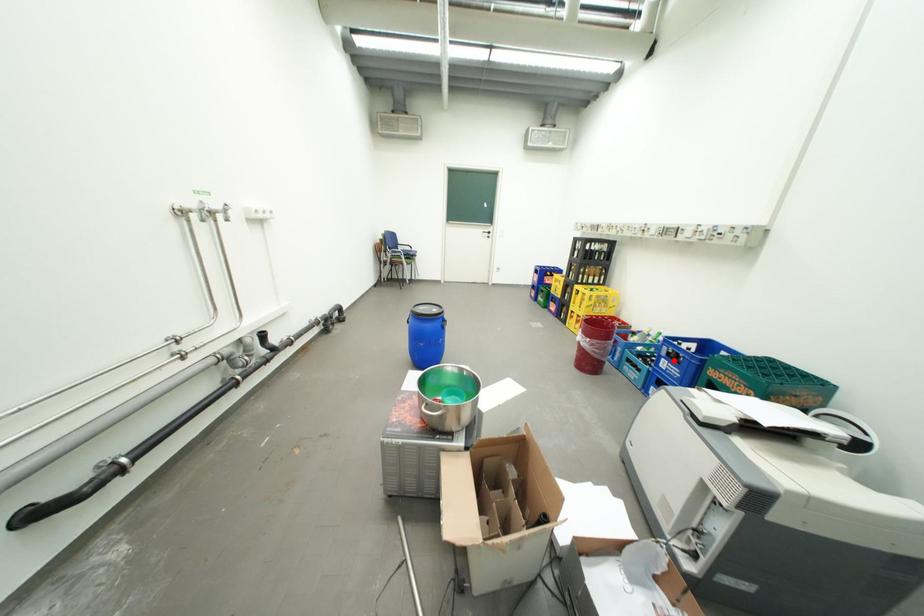
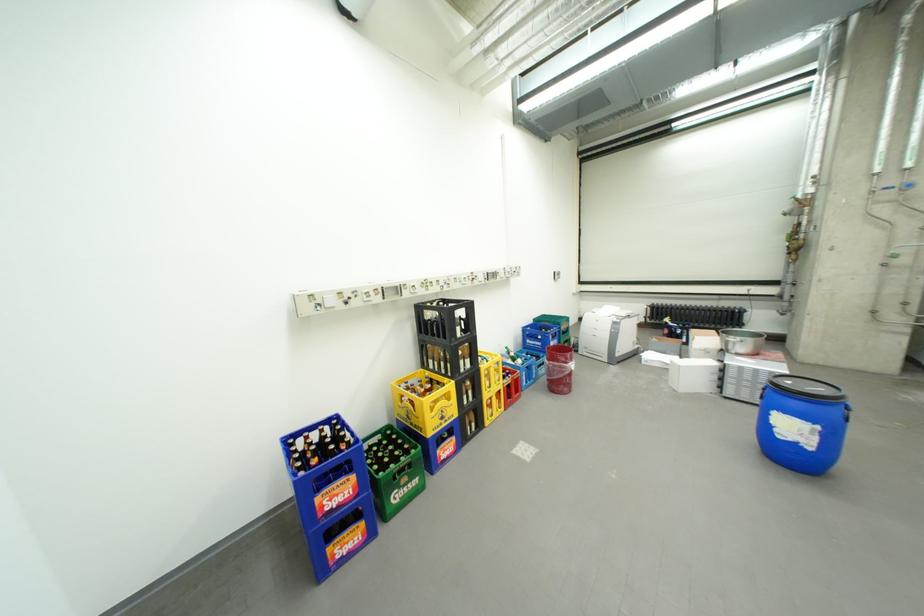
Find the pixel in the second image that matches the highlighted location in the first image.

(562, 344)